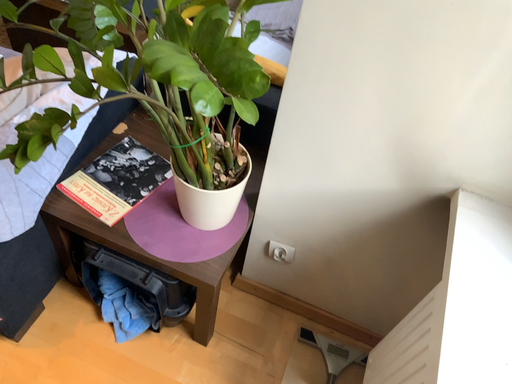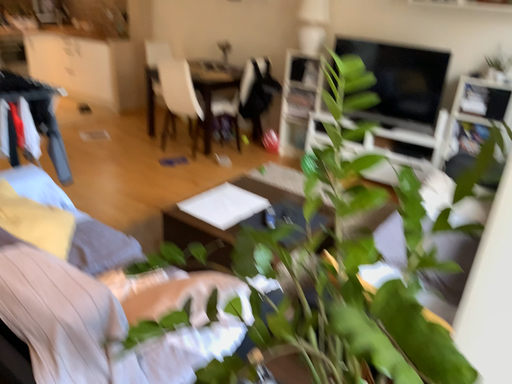
Question: How did the camera likely rotate when shooting the video?

Choices:
 (A) rotated upward
 (B) rotated downward

Answer: (A)